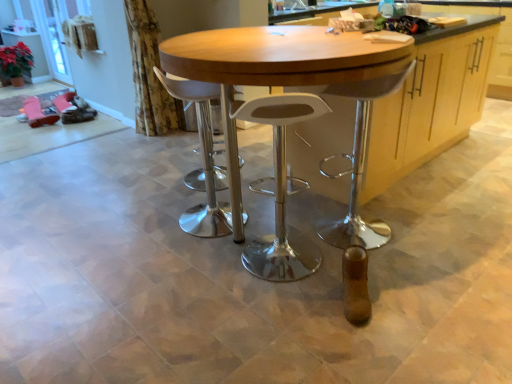
This screenshot has height=384, width=512. What are the coordinates of `vacant area that lies to the right of white plastic stool at center, arranged as the second stool when viewed from the right` in the screenshot? It's located at (265, 216).